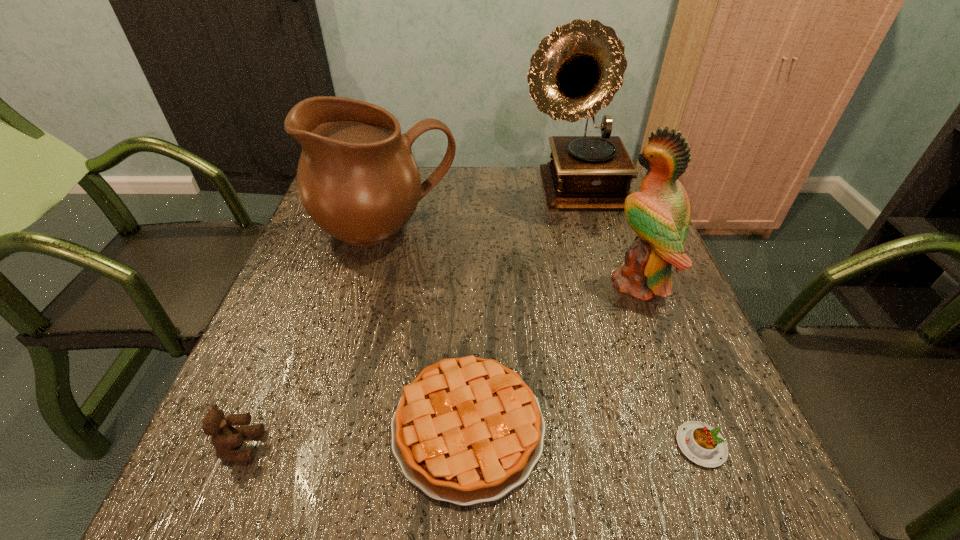
Identify the location of vacant space located 0.110m at the spout of the cream pitcher. The height and width of the screenshot is (540, 960). (369, 299).

Where is `vacant space situated 0.270m on the face of the fourth tallest object`? The width and height of the screenshot is (960, 540). vacant space situated 0.270m on the face of the fourth tallest object is located at coordinates (423, 446).

Find the location of a particular element. This screenshot has width=960, height=540. vacant region located on the back of the pie is located at coordinates (470, 325).

You are a GUI agent. You are given a task and a screenshot of the screen. Output one action in this format:
    pyautogui.click(x=<x>, y=<y>)
    Task: Click on the vacant area situated 0.200m on the left of the shortest object
    
    Given the screenshot: What is the action you would take?
    pyautogui.click(x=556, y=445)

The image size is (960, 540). What are the coordinates of `record player present at the far edge` in the screenshot? It's located at [x=576, y=71].

The width and height of the screenshot is (960, 540). Find the location of `cream pitcher that is at the far edge`. cream pitcher that is at the far edge is located at coordinates (357, 178).

Image resolution: width=960 pixels, height=540 pixels. I want to click on teddy bear present at the near edge, so click(225, 437).

Where is `pie located at the near edge`? The width and height of the screenshot is (960, 540). pie located at the near edge is located at coordinates (467, 430).

In order to click on pudding at the near edge in this screenshot , I will do `click(704, 445)`.

Identify the location of cream pitcher situated at the left edge. The width and height of the screenshot is (960, 540). (357, 178).